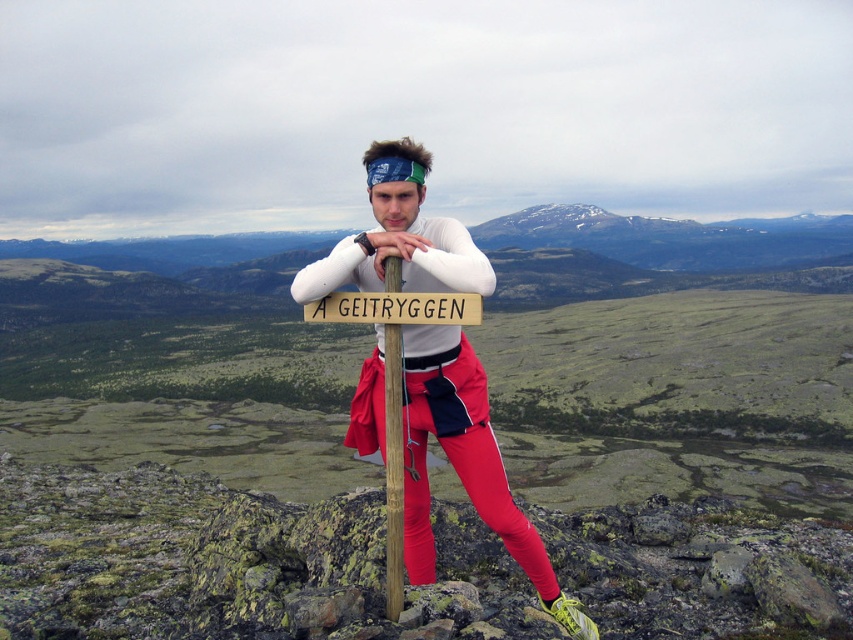
Question: Can you confirm if wooden signpost at center is positioned above wooden sign at center?

Choices:
 (A) no
 (B) yes

Answer: (A)

Question: Can you confirm if wooden signpost at center is positioned below wooden sign at center?

Choices:
 (A) yes
 (B) no

Answer: (A)

Question: Which of the following is the farthest from the observer?

Choices:
 (A) white matte shirt at center
 (B) wooden sign at center
 (C) wooden signpost at center

Answer: (C)

Question: Does white matte shirt at center have a smaller size compared to wooden signpost at center?

Choices:
 (A) yes
 (B) no

Answer: (B)

Question: Which of the following is the farthest from the observer?

Choices:
 (A) (393, 147)
 (B) (402, 493)
 (C) (373, 292)

Answer: (B)

Question: Which of the following is the farthest from the observer?

Choices:
 (A) white matte shirt at center
 (B) wooden sign at center

Answer: (B)